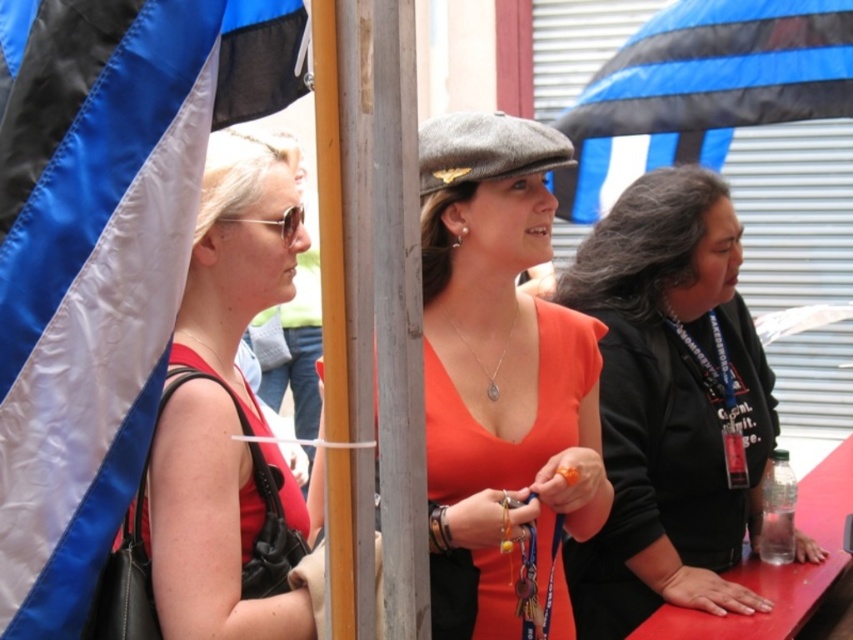
Can you confirm if matte black tank top at left is bigger than silver/chain necklace at center?

Indeed, matte black tank top at left has a larger size compared to silver/chain necklace at center.

The height and width of the screenshot is (640, 853). What do you see at coordinates (224, 406) in the screenshot?
I see `matte black tank top at left` at bounding box center [224, 406].

Is point (253, 509) less distant than point (454, 330)?

That is True.

At what (x,y) coordinates should I click in order to perform the action: click on matte black tank top at left. Please return your answer as a coordinate pair (x, y). The height and width of the screenshot is (640, 853). Looking at the image, I should click on (224, 406).

Does point (225, 269) come behind point (778, 3)?

No, it is not.

Who is more distant from viewer, (200, 280) or (593, 80)?

Point (593, 80)

Identify the location of matte black tank top at left. The height and width of the screenshot is (640, 853). (224, 406).

Between orange matte shirt at center and gray wool beret at center, which one appears on the right side from the viewer's perspective?

From the viewer's perspective, orange matte shirt at center appears more on the right side.

Can you confirm if orange matte shirt at center is thinner than gray wool beret at center?

In fact, orange matte shirt at center might be wider than gray wool beret at center.

Which is in front, point (682, 589) or point (474, 156)?

Point (474, 156) is in front.

Identify the location of orange matte shirt at center. (669, 403).